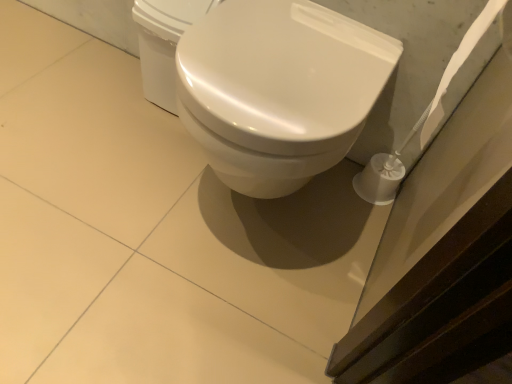
The image size is (512, 384). In order to click on vacant area situated to the left side of white glossy toilet at upper center in this screenshot , I will do `click(106, 83)`.